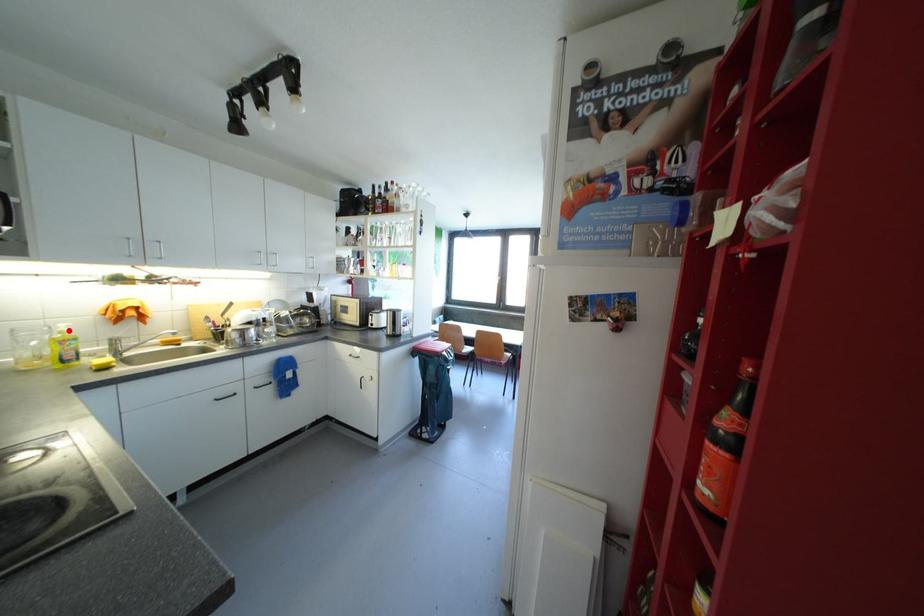
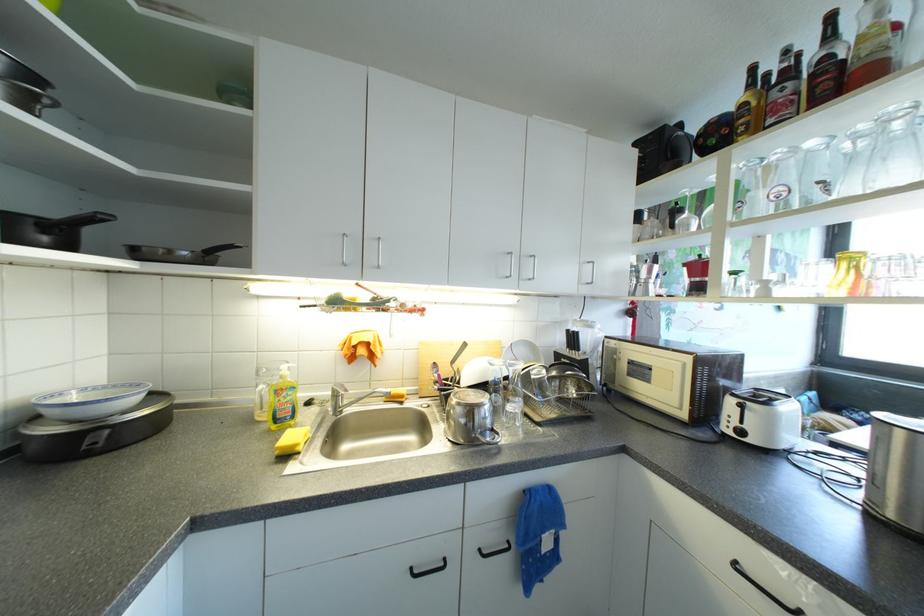
Find the pixel in the second image that matches the highlighted location in the first image.

(290, 373)